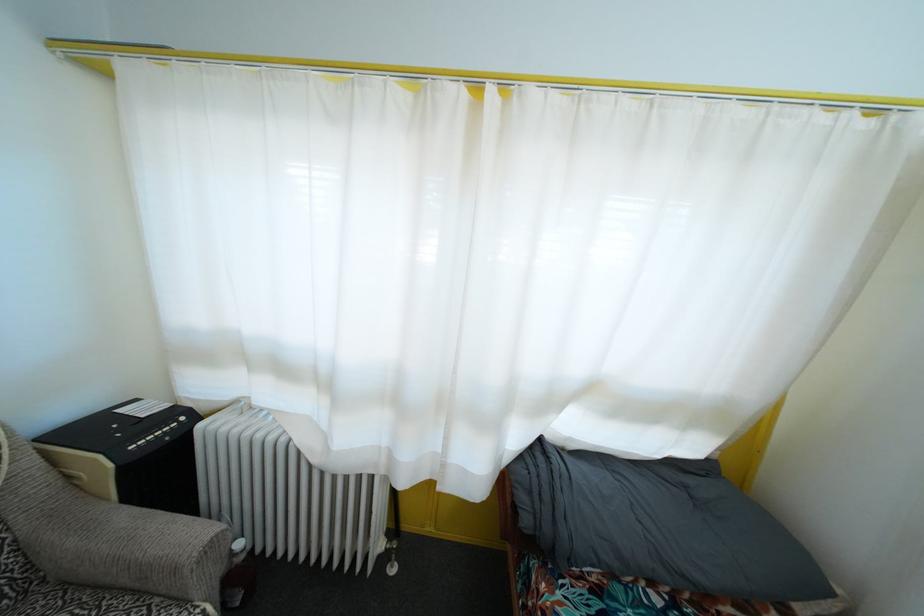
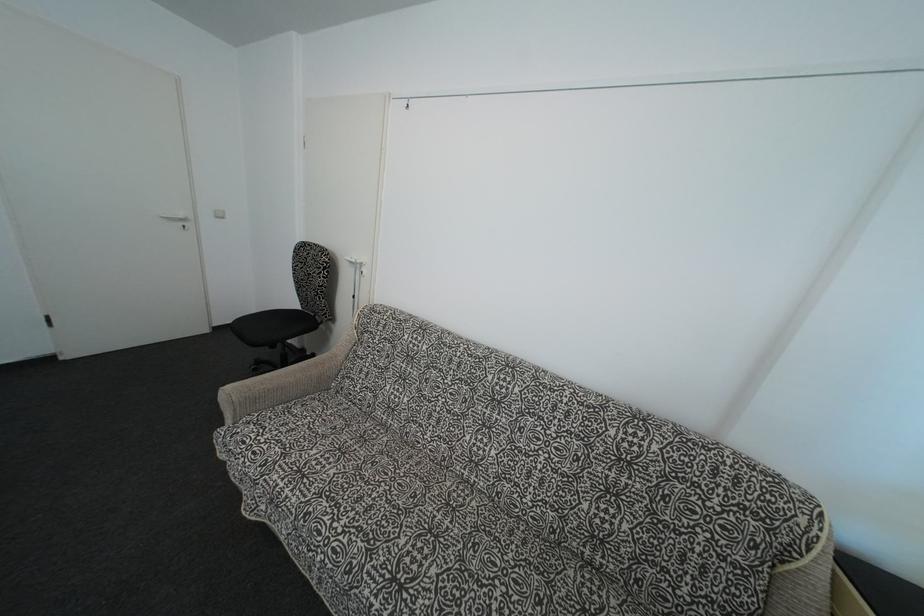
Question: Based on the continuous images, in which direction is the camera rotating? Reply with the corresponding letter.

Choices:
 (A) Left
 (B) Right
 (C) Up
 (D) Down

Answer: (A)